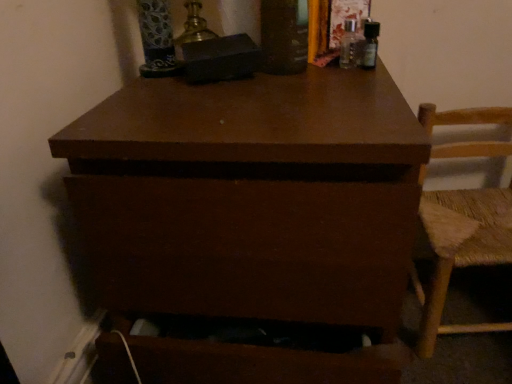
You are a GUI agent. You are given a task and a screenshot of the screen. Output one action in this format:
    pyautogui.click(x=<x>, y=<y>)
    Task: Click on the free space above brown matte chest of drawers at center (from a real-world perspective)
    This screenshot has height=384, width=512.
    Given the screenshot: What is the action you would take?
    pyautogui.click(x=259, y=92)